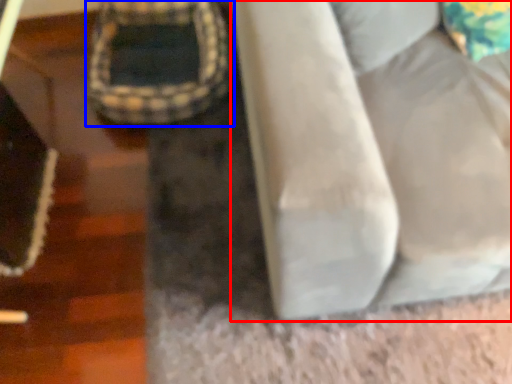
Question: Which object is further to the camera taking this photo, furniture (highlighted by a red box) or bean bag chair (highlighted by a blue box)?

Choices:
 (A) furniture
 (B) bean bag chair

Answer: (B)